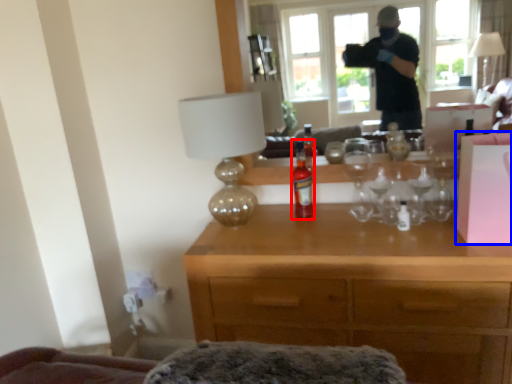
Question: Which object is closer to the camera taking this photo, bottle (highlighted by a red box) or box (highlighted by a blue box)?

Choices:
 (A) bottle
 (B) box

Answer: (B)